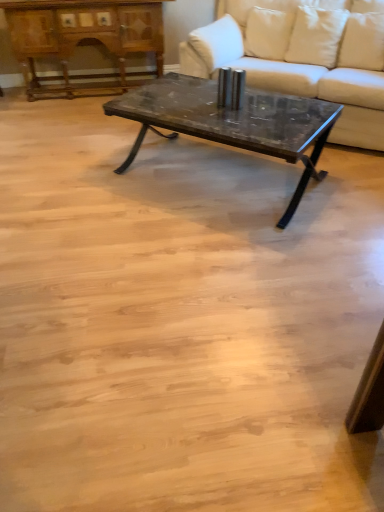
This screenshot has height=512, width=384. I want to click on free space in front of dark gray stone coffee table at center, so click(x=214, y=264).